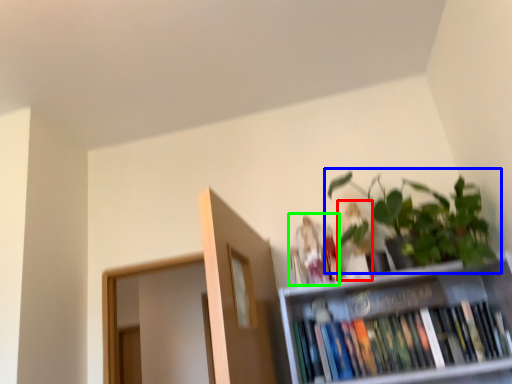
Question: Which object is positioned closest to toy (highlighted by a red box)? Select from houseplant (highlighted by a blue box) and toy (highlighted by a green box).

Choices:
 (A) houseplant
 (B) toy

Answer: (B)